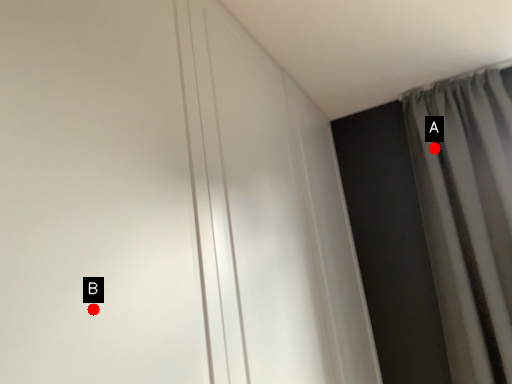
Question: Two points are circled on the image, labeled by A and B beside each circle. Which point is further to the camera?

Choices:
 (A) A is further
 (B) B is further

Answer: (A)